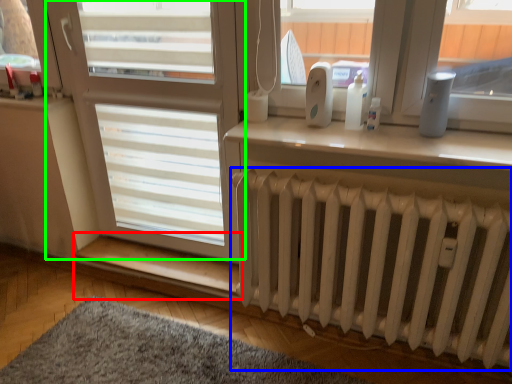
Question: Based on their relative distances, which object is farther from window sill (highlighted by a red box)? Choose from radiator (highlighted by a blue box) and screen door (highlighted by a green box).

Choices:
 (A) radiator
 (B) screen door

Answer: (A)